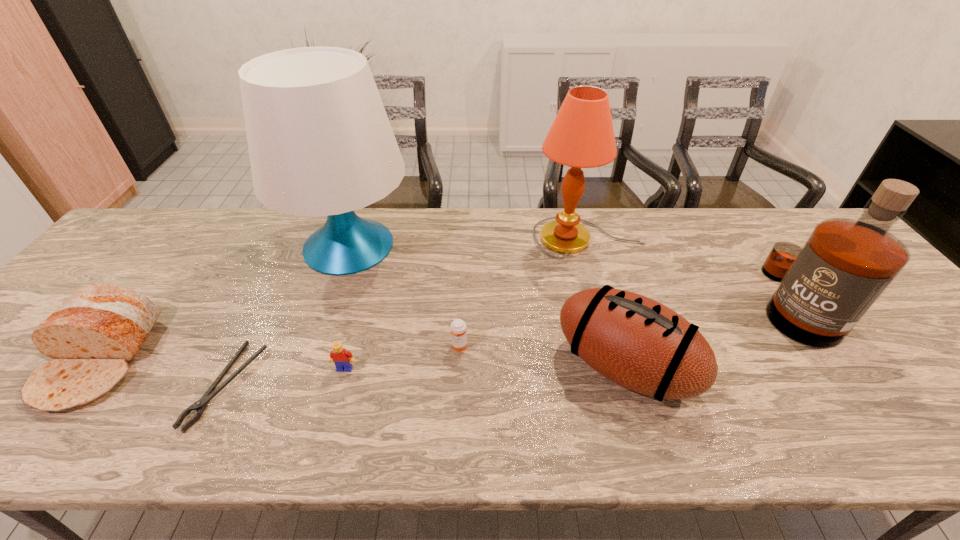
Image resolution: width=960 pixels, height=540 pixels. I want to click on lamp that is at the far edge, so click(582, 136).

I want to click on football (American) that is at the near edge, so [638, 343].

At what (x,y) coordinates should I click in order to perform the action: click on bread located in the near edge section of the desktop. Please return your answer as a coordinate pair (x, y). Looking at the image, I should click on (100, 327).

In order to click on tongs located at the near edge in this screenshot , I will do `click(200, 405)`.

This screenshot has width=960, height=540. I want to click on object that is positioned at the left edge, so click(100, 327).

Identify the location of object that is at the near left corner. (100, 327).

You are a GUI agent. You are given a task and a screenshot of the screen. Output one action in this format:
    pyautogui.click(x=<x>, y=<y>)
    Task: Click on the free spot at the far edge of the desktop
    The height and width of the screenshot is (540, 960).
    Given the screenshot: What is the action you would take?
    pyautogui.click(x=730, y=215)

In the image, there is a desktop. In order to click on free space at the near edge in this screenshot , I will do `click(364, 414)`.

I want to click on blank space at the right edge of the desktop, so (x=895, y=322).

What are the coordinates of `free space at the far left corner` in the screenshot? It's located at (156, 222).